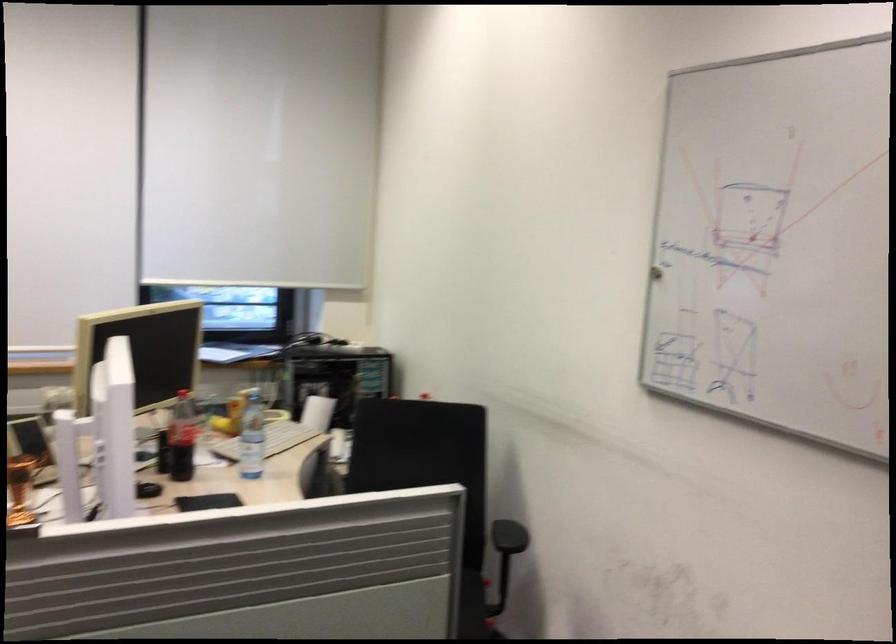
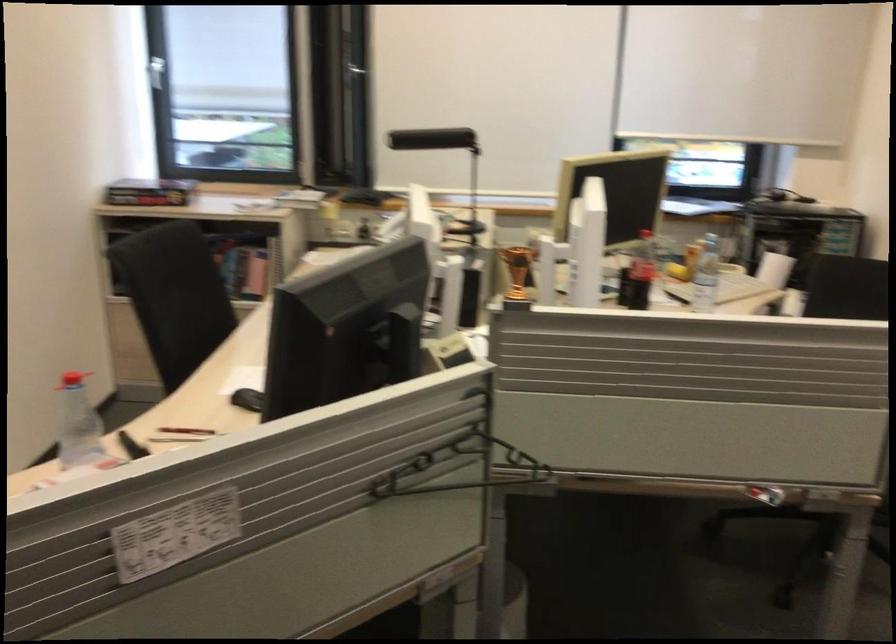
In the second image, find the point that corresponds to pixel 20 489 in the first image.

(513, 299)